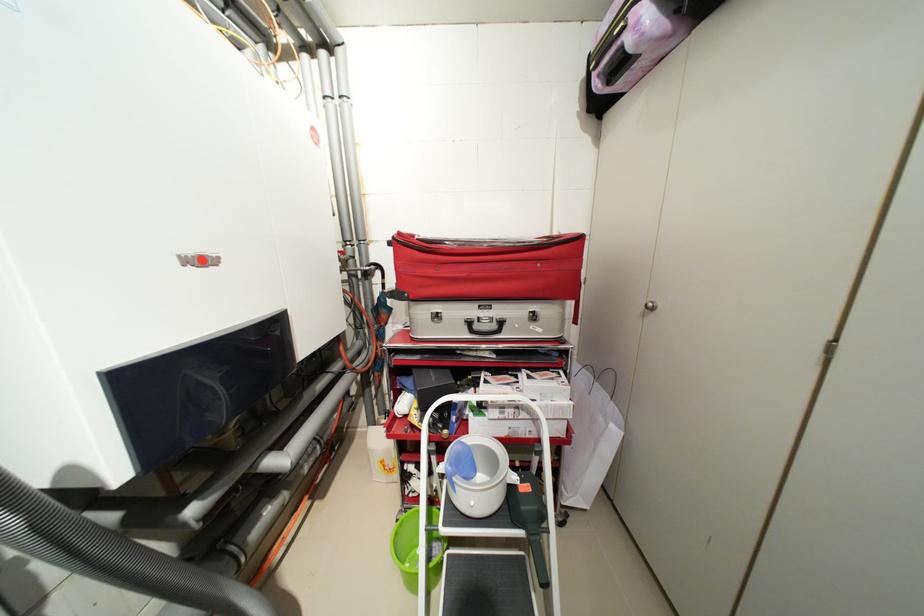
This screenshot has height=616, width=924. Identify the location of silver door knob. (650, 306).